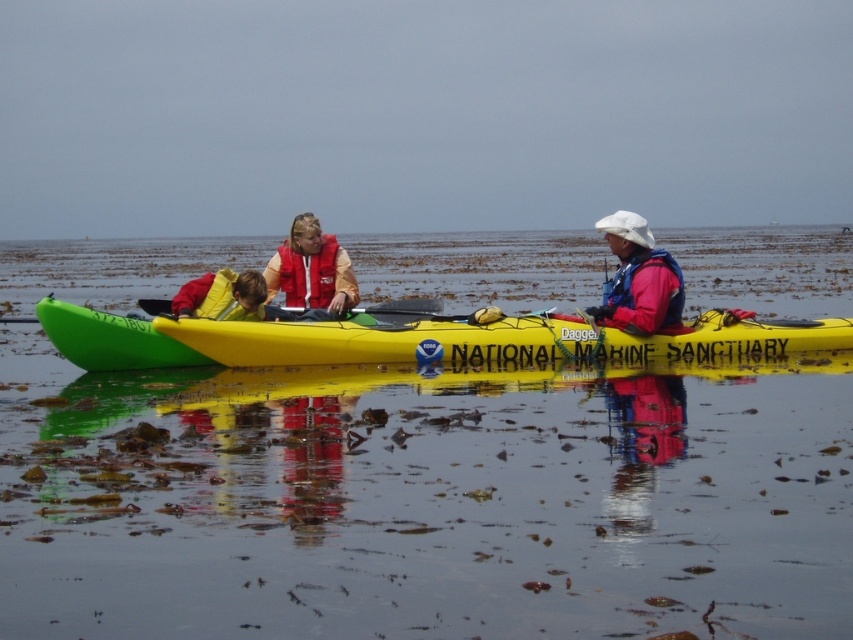
You are a safety inspector checking the kayaking equipment. You notice the green plastic kayak at center and the red life vest at center. According to safety regulations, the distance between the kayak and the life vest must be within 2 meters. Is the current distance compliant with the regulation?

The green plastic kayak at center is 4.08 meters from the red life vest at center. Since the required distance is within 2 meters, the current distance of 4.08 meters exceeds the regulation, so it is not compliant.